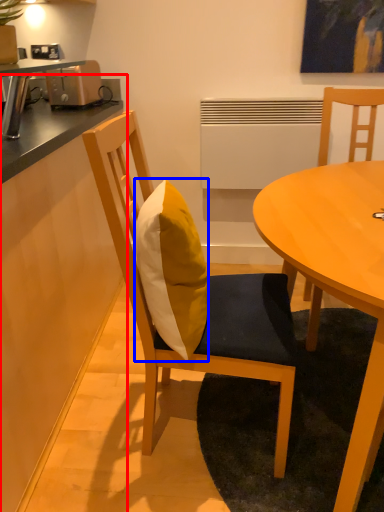
Question: Which point is further to the camera, counter (highlighted by a red box) or pillow (highlighted by a blue box)?

Choices:
 (A) counter
 (B) pillow

Answer: (B)